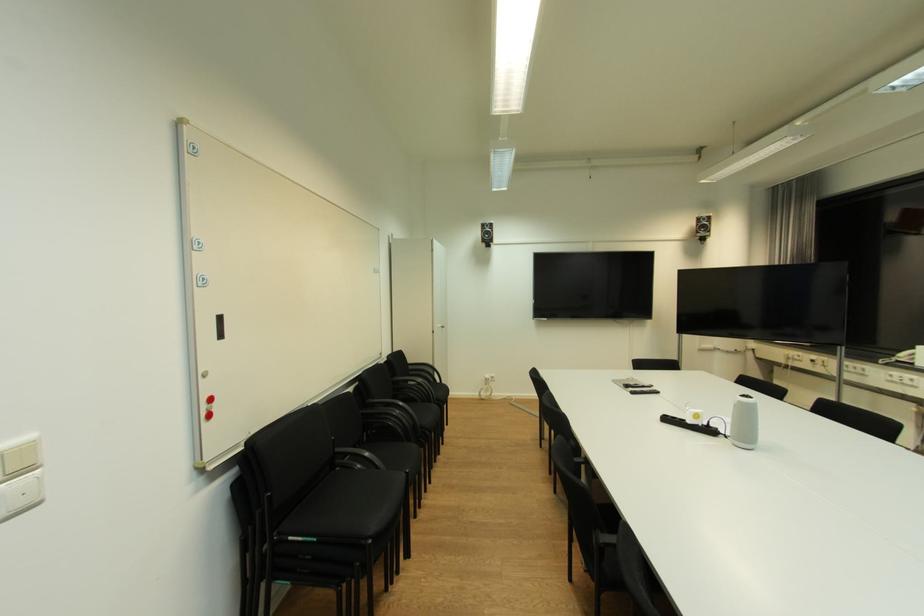
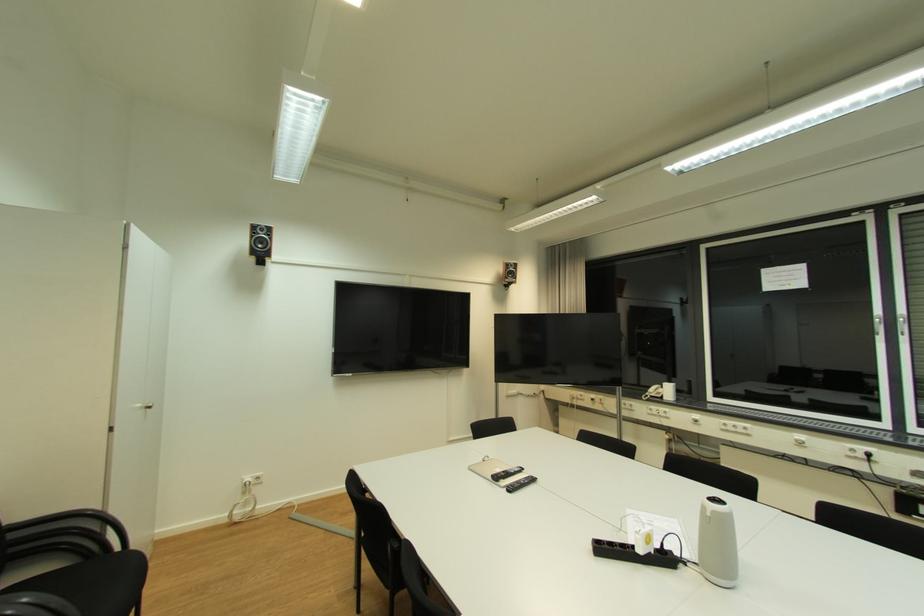
The point at (445, 326) is marked in the first image. Where is the corresponding point in the second image?

(146, 407)